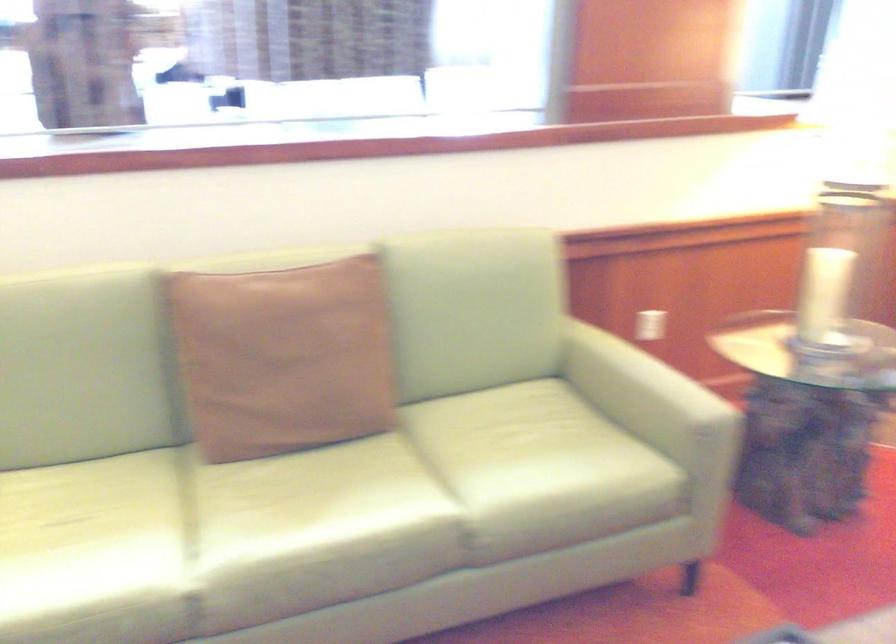
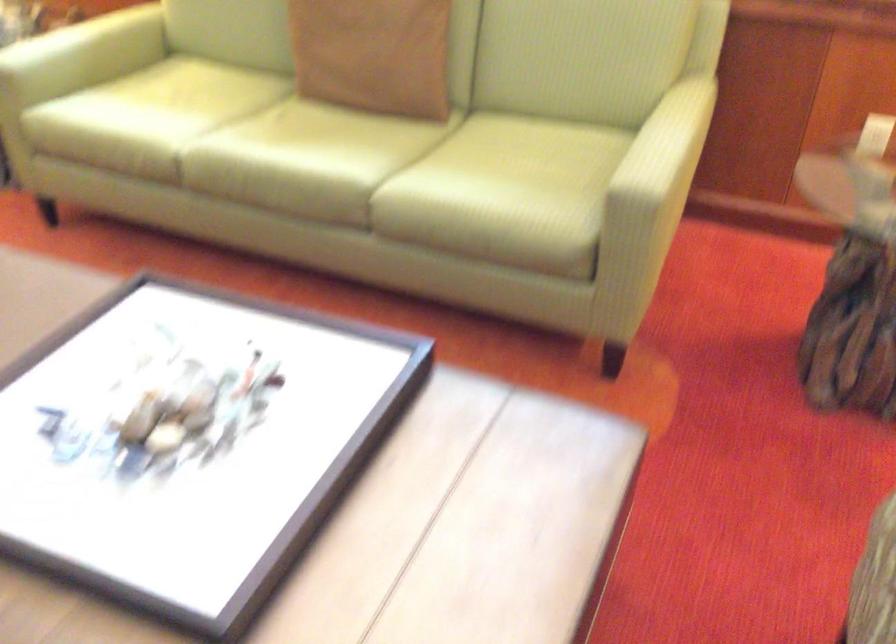
The point at (512, 487) is marked in the first image. Where is the corresponding point in the second image?

(429, 182)